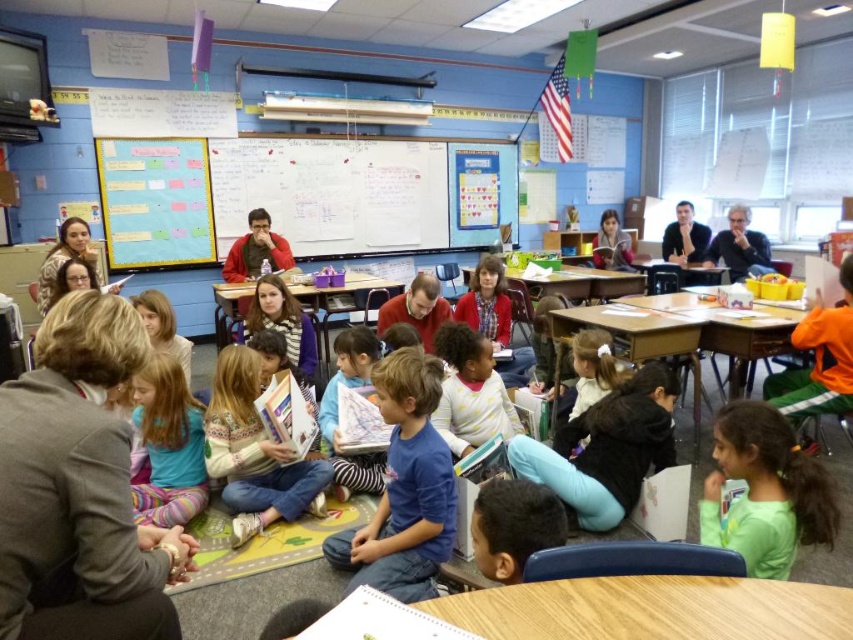
You are a teacher in the classroom. You notice two sweaters left on the floor by students. The gray wool sweater at lower left and the yellow dotted sweater at center. Which sweater is closer to the whiteboard at the back of the room?

The gray wool sweater at lower left is positioned under the yellow dotted sweater at center, so the gray wool sweater at lower left is closer to the whiteboard at the back of the room.

You are a student in the classroom and want to hand a note to the teacher who is standing near the knitted sweater at center. You are currently near the gray wool sweater at lower left. To reach the teacher, should you move to your left or right?

The gray wool sweater at lower left is positioned on the right side of knitted sweater at center. Therefore, to reach the teacher near the knitted sweater at center from the gray wool sweater at lower left, you should move to your left.